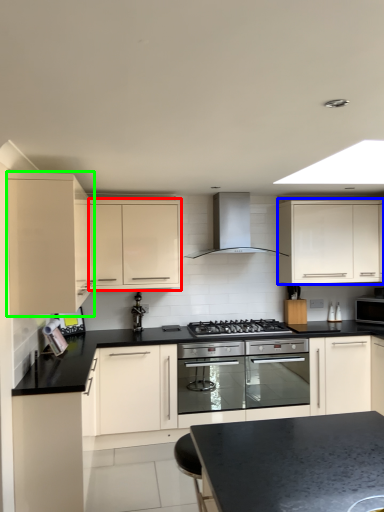
Question: Which is farther away from cabinetry (highlighted by a red box)? cabinetry (highlighted by a blue box) or cabinetry (highlighted by a green box)?

Choices:
 (A) cabinetry
 (B) cabinetry

Answer: (A)